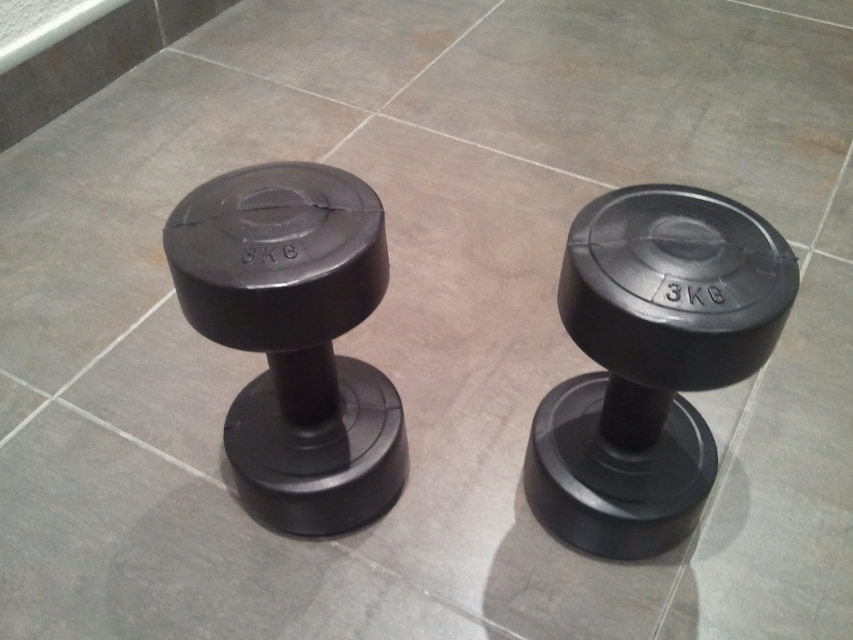
Question: Among these objects, which one is nearest to the camera?

Choices:
 (A) matte black dumbbell at left
 (B) matte black dumbbell at center

Answer: (B)

Question: Can you confirm if matte black dumbbell at center is positioned below matte black dumbbell at left?

Choices:
 (A) no
 (B) yes

Answer: (B)

Question: Does matte black dumbbell at center appear on the left side of matte black dumbbell at left?

Choices:
 (A) no
 (B) yes

Answer: (A)

Question: Can you confirm if matte black dumbbell at center is positioned above matte black dumbbell at left?

Choices:
 (A) yes
 (B) no

Answer: (B)